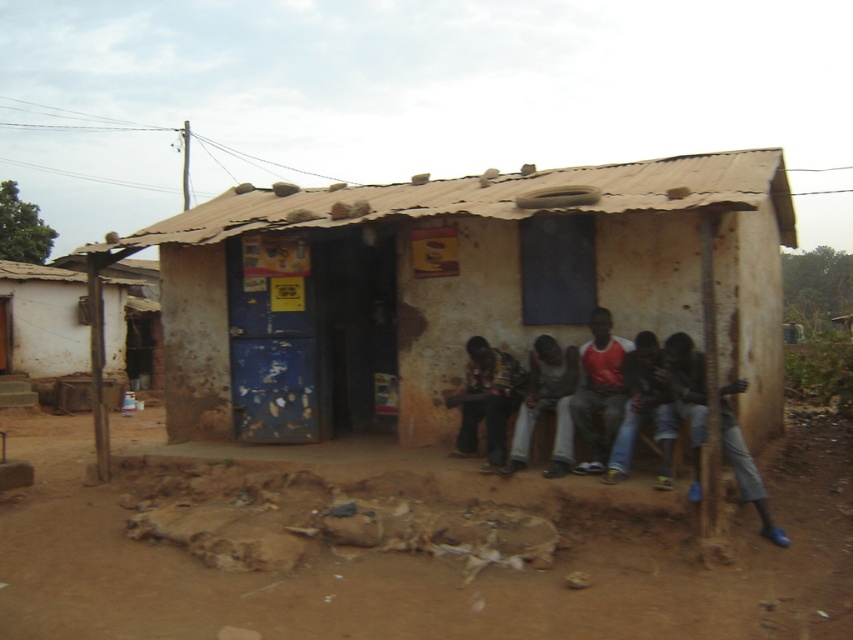
Does white corrugated metal hut at left have a greater width compared to dark gray fabric pants at lower center?

No.

Which is in front, point (140, 353) or point (666, 384)?

Point (666, 384)

Where is `white corrugated metal hut at left`? This screenshot has height=640, width=853. white corrugated metal hut at left is located at coordinates (45, 321).

This screenshot has width=853, height=640. I want to click on white corrugated metal hut at left, so click(45, 321).

Can you confirm if brown mud hut at center is thinner than blue denim pants at lower right?

Incorrect, brown mud hut at center's width is not less than blue denim pants at lower right's.

This screenshot has height=640, width=853. What are the coordinates of `brown mud hut at center` in the screenshot? It's located at (457, 289).

Describe the element at coordinates (457, 289) in the screenshot. I see `brown mud hut at center` at that location.

Where is `brown mud hut at center`? This screenshot has width=853, height=640. brown mud hut at center is located at coordinates (457, 289).

Between dark gray fabric pants at lower center and blue denim pants at lower right, which one is positioned higher?

blue denim pants at lower right is above.

Is dark gray fabric pants at lower center above blue denim pants at lower right?

Incorrect, dark gray fabric pants at lower center is not positioned above blue denim pants at lower right.

Where is `dark gray fabric pants at lower center`? This screenshot has width=853, height=640. dark gray fabric pants at lower center is located at coordinates (666, 404).